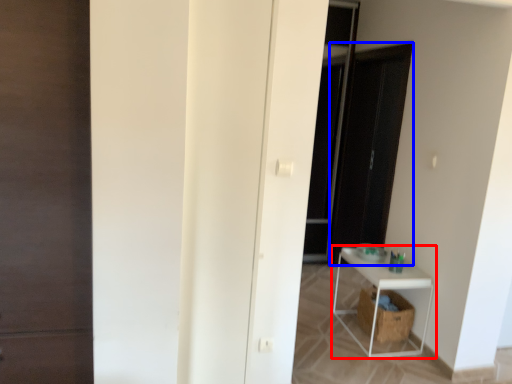
Question: Which of the following is the closest to the observer, shelf (highlighted by a red box) or screen door (highlighted by a blue box)?

Choices:
 (A) shelf
 (B) screen door

Answer: (A)